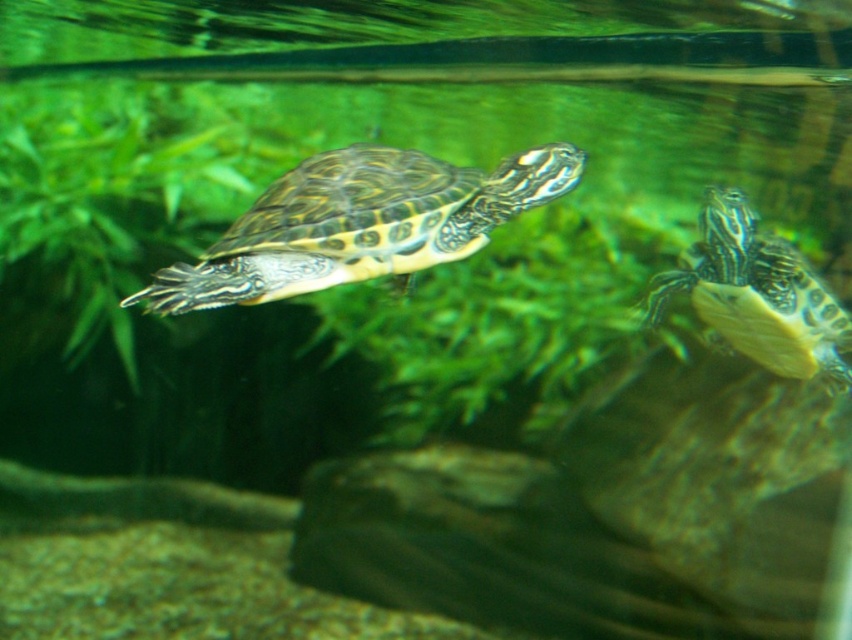
You are an underwater photographer aiming to capture a clear photo of both the patterned shell turtle at center and the patterned shell turtle at right. Since you can only focus on one turtle at a time, which turtle should you focus on to ensure the other remains in the background?

You should focus on the patterned shell turtle at center because it is closer to the viewer, and the patterned shell turtle at right will naturally be in the background.

You are an underwater photographer aiming to capture both the patterned shell turtle at center and the patterned shell turtle at right in a single frame. Based on their positions, which turtle is closer to the camera?

The patterned shell turtle at center is closer to the camera because it is positioned above the patterned shell turtle at right, indicating it is in the foreground.